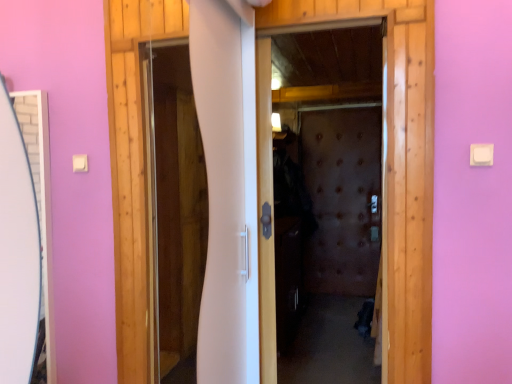
Question: From the image's perspective, does white glossy screen door at center, placed as the second screen door when sorted from back to front, appear higher than brown textured screen door at center, placed as the second screen door when sorted from front to back?

Choices:
 (A) no
 (B) yes

Answer: (B)

Question: Is white glossy screen door at center, placed as the second screen door when sorted from back to front, oriented towards brown textured screen door at center, placed as the first screen door when sorted from back to front?

Choices:
 (A) yes
 (B) no

Answer: (B)

Question: Is white glossy screen door at center, placed as the second screen door when sorted from back to front, wider than brown textured screen door at center, the 2th screen door from the left?

Choices:
 (A) no
 (B) yes

Answer: (A)

Question: Can you confirm if white glossy screen door at center, placed as the second screen door when sorted from back to front, is bigger than brown textured screen door at center, the first screen door viewed from the right?

Choices:
 (A) yes
 (B) no

Answer: (B)

Question: Would you say white glossy screen door at center, the 2th screen door from the right, is a long distance from brown textured screen door at center, placed as the second screen door when sorted from front to back?

Choices:
 (A) no
 (B) yes

Answer: (B)

Question: Can you confirm if white glossy screen door at center, the 2th screen door from the right, is thinner than brown textured screen door at center, the first screen door viewed from the right?

Choices:
 (A) no
 (B) yes

Answer: (B)

Question: Is brown textured screen door at center, placed as the second screen door when sorted from front to back, to the left of white glossy screen door at center, which is counted as the first screen door, starting from the left, from the viewer's perspective?

Choices:
 (A) yes
 (B) no

Answer: (B)

Question: Does brown textured screen door at center, placed as the first screen door when sorted from back to front, have a smaller size compared to white glossy screen door at center, the first screen door viewed from the front?

Choices:
 (A) no
 (B) yes

Answer: (A)

Question: Is brown textured screen door at center, the 2th screen door from the left, not inside white glossy screen door at center, the 2th screen door from the right?

Choices:
 (A) yes
 (B) no

Answer: (A)

Question: Is brown textured screen door at center, the first screen door viewed from the right, facing away from white glossy screen door at center, the first screen door viewed from the front?

Choices:
 (A) no
 (B) yes

Answer: (A)

Question: From the image's perspective, is brown textured screen door at center, the first screen door viewed from the right, beneath white glossy screen door at center, the first screen door viewed from the front?

Choices:
 (A) yes
 (B) no

Answer: (A)

Question: Is brown textured screen door at center, placed as the second screen door when sorted from front to back, shorter than white glossy screen door at center, the first screen door viewed from the front?

Choices:
 (A) yes
 (B) no

Answer: (B)

Question: In the image, is white glossy screen door at center, placed as the second screen door when sorted from back to front, positioned in front of or behind brown textured screen door at center, the first screen door viewed from the right?

Choices:
 (A) behind
 (B) front

Answer: (B)